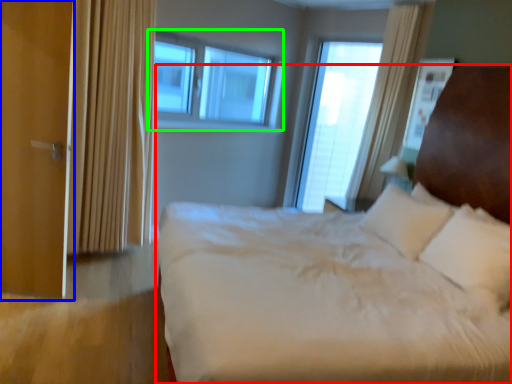
Question: Considering the real-world distances, which object is closest to bed (highlighted by a red box)? screen door (highlighted by a blue box) or window (highlighted by a green box).

Choices:
 (A) screen door
 (B) window

Answer: (A)